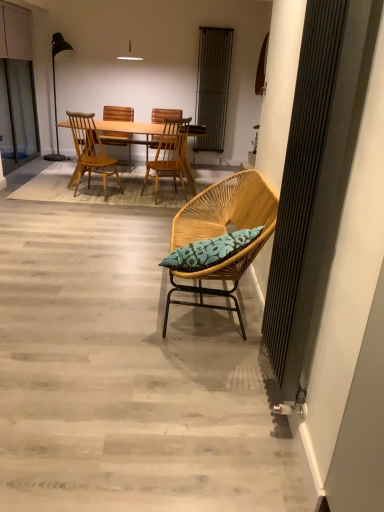
Question: From a real-world perspective, is woven wood chair with blue cushion at center, marked as the 1th chair in a front-to-back arrangement, positioned above or below matte black floor lamp at left?

Choices:
 (A) above
 (B) below

Answer: (B)

Question: Do you think woven wood chair with blue cushion at center, marked as the 1th chair in a front-to-back arrangement, is within matte black floor lamp at left, or outside of it?

Choices:
 (A) inside
 (B) outside

Answer: (B)

Question: Which of these objects is positioned farthest from the green leafy plant at upper right?

Choices:
 (A) matte black floor lamp at left
 (B) transparent glass screen door at left
 (C) metallic silver radiator at upper center
 (D) wooden beach chair at center
 (E) light wood table at center

Answer: (A)

Question: Estimate the real-world distances between objects in this image. Which object is farther from the matte black floor lamp at left?

Choices:
 (A) metallic silver radiator at upper center
 (B) woven wood chair with blue cushion at center, the 4th chair viewed from the back
 (C) transparent glass screen door at left
 (D) light brown wood chair at center, the third chair when ordered from back to front
 (E) wooden chair at center, the third chair viewed from the front

Answer: (B)